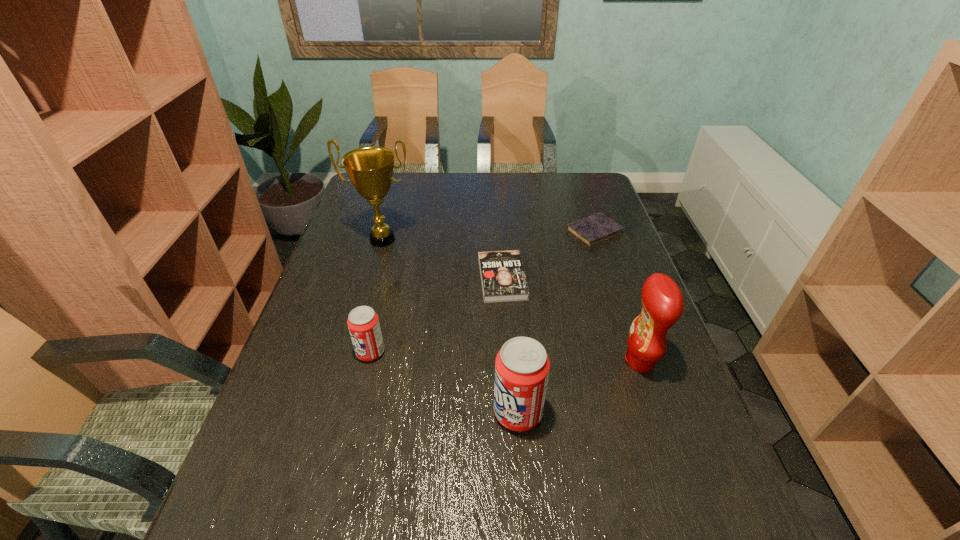
The height and width of the screenshot is (540, 960). Find the location of `free spot between the shorter soda can and the second shortest object`. free spot between the shorter soda can and the second shortest object is located at coordinates (437, 315).

I want to click on free space between the shorter soda can and the fourth nearest object, so click(437, 315).

Image resolution: width=960 pixels, height=540 pixels. I want to click on free point between the fourth shortest object and the shorter soda can, so click(x=444, y=382).

In order to click on free space between the fifth shortest object and the fourth nearest object in this screenshot , I will do `click(571, 320)`.

I want to click on free space that is in between the taller soda can and the award, so click(450, 326).

This screenshot has width=960, height=540. I want to click on vacant point located between the farther soda can and the shortest object, so click(x=483, y=292).

Locate an element on the screen. This screenshot has height=540, width=960. unoccupied area between the award and the shortest object is located at coordinates (489, 235).

Locate an element on the screen. The width and height of the screenshot is (960, 540). object that is the fourth closest to the second tallest object is located at coordinates (363, 323).

Locate which object ranks fifth in proximity to the fourth shortest object. Please provide its 2D coordinates. Your answer should be formatted as a tuple, i.e. [(x, y)], where the tuple contains the x and y coordinates of a point satisfying the conditions above.

[(592, 230)]

This screenshot has height=540, width=960. Identify the location of free region that satisfies the following two spatial constraints: 1. on the front view with handles of the award; 2. on the right side of the book. (372, 279).